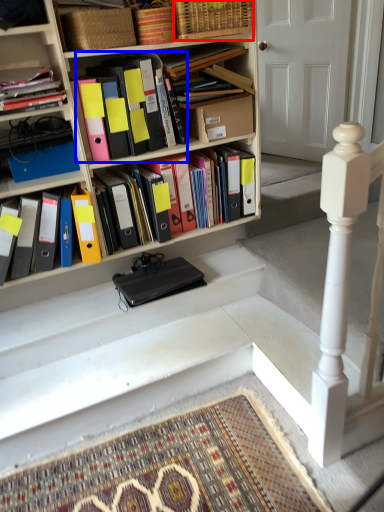
Question: Which object is further to the camera taking this photo, basket (highlighted by a red box) or book (highlighted by a blue box)?

Choices:
 (A) basket
 (B) book

Answer: (A)